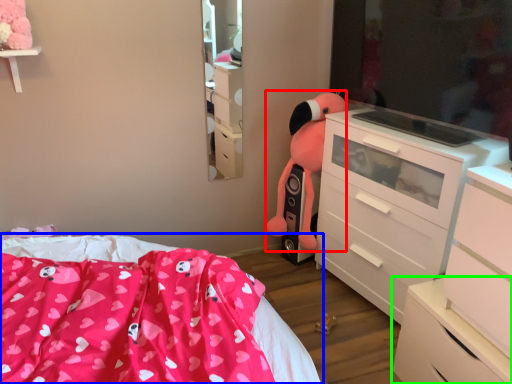
Question: Which is farther away from animal (highlighted by a red box)? bed (highlighted by a blue box) or chest of drawers (highlighted by a green box)?

Choices:
 (A) bed
 (B) chest of drawers

Answer: (B)